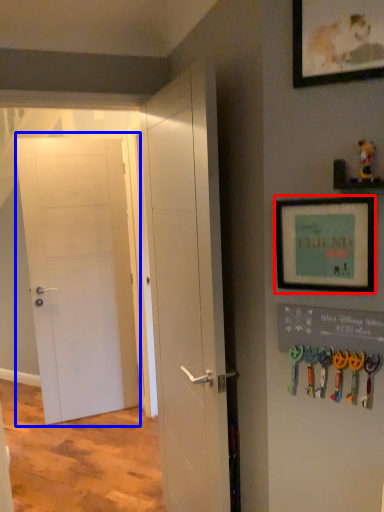
Question: Which point is closer to the camera, picture frame (highlighted by a red box) or door (highlighted by a blue box)?

Choices:
 (A) picture frame
 (B) door

Answer: (A)